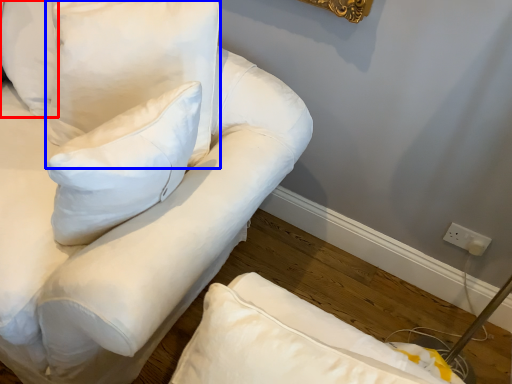
Question: Which of the following is the farthest to the observer, pillow (highlighted by a red box) or pillow (highlighted by a blue box)?

Choices:
 (A) pillow
 (B) pillow

Answer: (A)